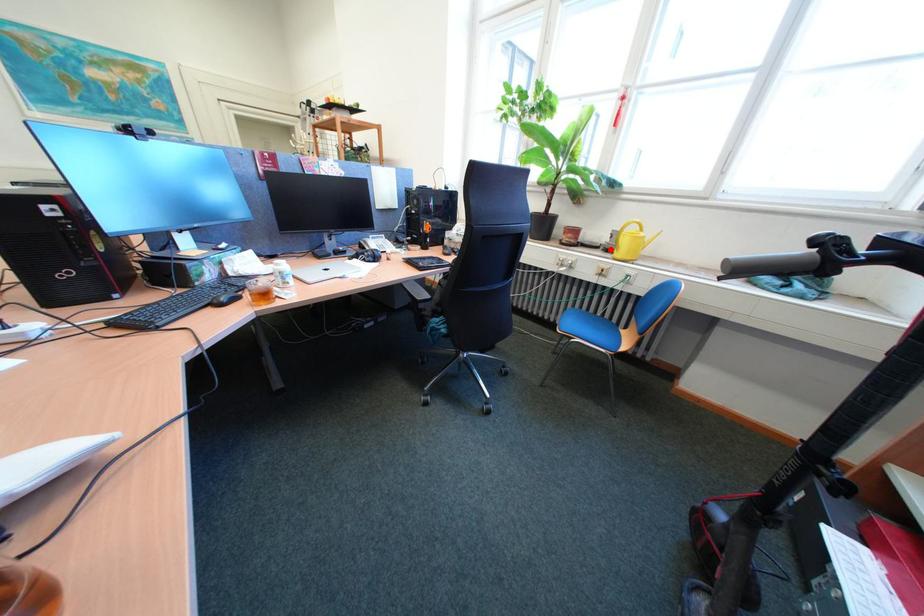
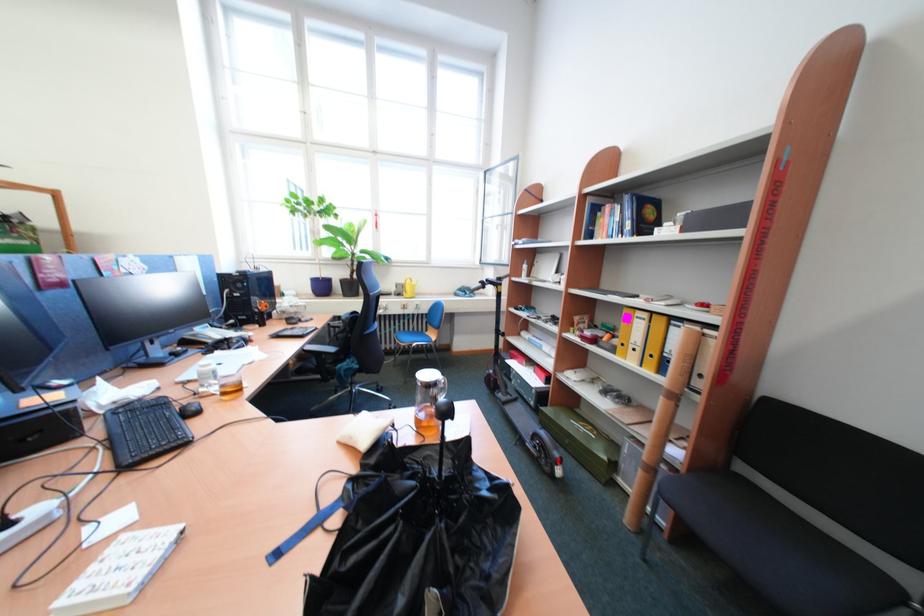
Locate, in the second image, the point that corresponds to the highlighted location in the first image.

(403, 296)